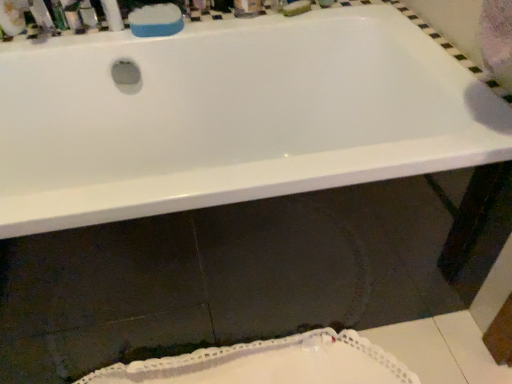
Find the location of a particular element. The width and height of the screenshot is (512, 384). white lace doily at lower center is located at coordinates (269, 363).

What is the approximate width of white lace doily at lower center?

The width of white lace doily at lower center is 20.89 centimeters.

Describe the element at coordinates (58, 15) in the screenshot. Image resolution: width=512 pixels, height=384 pixels. I see `metallic silver soap at upper left, the third toiletry viewed from the right` at that location.

Locate an element on the screen. metallic silver soap at upper left, the third toiletry viewed from the right is located at coordinates (58, 15).

This screenshot has height=384, width=512. What do you see at coordinates (232, 116) in the screenshot?
I see `white glossy bathtub at upper center` at bounding box center [232, 116].

What do you see at coordinates (73, 15) in the screenshot? This screenshot has width=512, height=384. I see `matte plastic toothbrush at upper left, the 2th toiletry in the left-to-right sequence` at bounding box center [73, 15].

Find the location of a particular element. The image size is (512, 384). white plastic mouthwash at upper left is located at coordinates [13, 16].

From the image's perspective, between matte plastic toothbrush at upper left, the 2th toiletry in the left-to-right sequence, and white plastic mouthwash at upper left, which one is located above?

matte plastic toothbrush at upper left, the 2th toiletry in the left-to-right sequence, from the image's perspective.

Considering the sizes of objects matte plastic toothbrush at upper left, the 2th toiletry in the left-to-right sequence, and white plastic mouthwash at upper left in the image provided, who is wider, matte plastic toothbrush at upper left, the 2th toiletry in the left-to-right sequence, or white plastic mouthwash at upper left?

With larger width is matte plastic toothbrush at upper left, the 2th toiletry in the left-to-right sequence.

How much distance is there between matte plastic toothbrush at upper left, the 2th toiletry in the left-to-right sequence, and white plastic mouthwash at upper left?

5.68 inches.

Is matte plastic toothbrush at upper left, acting as the second toiletry starting from the right, oriented away from white plastic mouthwash at upper left?

No, matte plastic toothbrush at upper left, acting as the second toiletry starting from the right, is not facing away from white plastic mouthwash at upper left.

Is point (168, 22) in front of point (52, 5)?

That is True.

From a real-world perspective, is blue sponge at upper center located beneath metallic silver soap at upper left, the third toiletry viewed from the right?

Yes, from a real-world perspective, blue sponge at upper center is under metallic silver soap at upper left, the third toiletry viewed from the right.

Is blue sponge at upper center not close to metallic silver soap at upper left, which is counted as the first toiletry, starting from the left?

No, blue sponge at upper center is not far away from metallic silver soap at upper left, which is counted as the first toiletry, starting from the left.

Considering the sizes of objects blue sponge at upper center and metallic silver soap at upper left, the third toiletry viewed from the right, in the image provided, who is smaller, blue sponge at upper center or metallic silver soap at upper left, the third toiletry viewed from the right,?

metallic silver soap at upper left, the third toiletry viewed from the right, is smaller.

From a real-world perspective, is white glossy bathtub at upper center above or below blue sponge at upper center?

In terms of real-world spatial position, white glossy bathtub at upper center is below blue sponge at upper center.

Is white glossy bathtub at upper center not inside blue sponge at upper center?

Yes, white glossy bathtub at upper center is not within blue sponge at upper center.

From the image's perspective, which is below, white glossy bathtub at upper center or blue sponge at upper center?

From the image's view, white glossy bathtub at upper center is below.

Considering the relative positions of white glossy bathtub at upper center and blue sponge at upper center in the image provided, is white glossy bathtub at upper center to the left of blue sponge at upper center from the viewer's perspective?

Incorrect, white glossy bathtub at upper center is not on the left side of blue sponge at upper center.

From the image's perspective, is metallic silver container at upper left, which is the 3th toiletry from left to right, positioned above or below metallic silver soap at upper left, the third toiletry viewed from the right?

Clearly, from the image's perspective, metallic silver container at upper left, which is the 3th toiletry from left to right, is below metallic silver soap at upper left, the third toiletry viewed from the right.

Considering the sizes of metallic silver container at upper left, which is the 3th toiletry from left to right, and metallic silver soap at upper left, which is counted as the first toiletry, starting from the left, in the image, is metallic silver container at upper left, which is the 3th toiletry from left to right, wider or thinner than metallic silver soap at upper left, which is counted as the first toiletry, starting from the left,?

Clearly, metallic silver container at upper left, which is the 3th toiletry from left to right, has more width compared to metallic silver soap at upper left, which is counted as the first toiletry, starting from the left.

Are metallic silver container at upper left, which is the 1th toiletry from right to left, and metallic silver soap at upper left, which is counted as the first toiletry, starting from the left, making contact?

Yes, metallic silver container at upper left, which is the 1th toiletry from right to left, and metallic silver soap at upper left, which is counted as the first toiletry, starting from the left, clearly make contact.

Is metallic silver container at upper left, which is the 1th toiletry from right to left, taller than metallic silver soap at upper left, which is counted as the first toiletry, starting from the left?

No.

Between metallic silver container at upper left, which is the 3th toiletry from left to right, and white plastic mouthwash at upper left, which one appears on the left side from the viewer's perspective?

Positioned to the left is white plastic mouthwash at upper left.

Would you say metallic silver container at upper left, which is the 1th toiletry from right to left, contains white plastic mouthwash at upper left?

No, white plastic mouthwash at upper left is not surrounded by metallic silver container at upper left, which is the 1th toiletry from right to left.

From a real-world perspective, which is physically above, metallic silver container at upper left, which is the 3th toiletry from left to right, or white plastic mouthwash at upper left?

In real-world perspective, white plastic mouthwash at upper left is above.

You are a GUI agent. You are given a task and a screenshot of the screen. Output one action in this format:
    pyautogui.click(x=<x>, y=<y>)
    Task: Click on the mouthwash on the left of the metallic silver soap at upper left, which is counted as the first toiletry, starting from the left
    
    Given the screenshot: What is the action you would take?
    pyautogui.click(x=13, y=16)

Which is more to the left, metallic silver soap at upper left, which is counted as the first toiletry, starting from the left, or white plastic mouthwash at upper left?

From the viewer's perspective, white plastic mouthwash at upper left appears more on the left side.

How different are the orientations of metallic silver soap at upper left, which is counted as the first toiletry, starting from the left, and white plastic mouthwash at upper left in degrees?

There is a 63.4-degree angle between the facing directions of metallic silver soap at upper left, which is counted as the first toiletry, starting from the left, and white plastic mouthwash at upper left.

Is metallic silver soap at upper left, the third toiletry viewed from the right, completely or partially outside of white plastic mouthwash at upper left?

Yes, metallic silver soap at upper left, the third toiletry viewed from the right, is located beyond the bounds of white plastic mouthwash at upper left.

Which is more to the left, metallic silver container at upper left, which is the 3th toiletry from left to right, or white glossy bathtub at upper center?

From the viewer's perspective, metallic silver container at upper left, which is the 3th toiletry from left to right, appears more on the left side.

Is metallic silver container at upper left, which is the 1th toiletry from right to left, facing away from white glossy bathtub at upper center?

No, metallic silver container at upper left, which is the 1th toiletry from right to left,'s orientation is not away from white glossy bathtub at upper center.

From the image's perspective, which one is positioned lower, metallic silver container at upper left, which is the 1th toiletry from right to left, or white glossy bathtub at upper center?

white glossy bathtub at upper center appears lower in the image.

What's the angular difference between metallic silver container at upper left, which is the 1th toiletry from right to left, and white glossy bathtub at upper center's facing directions?

metallic silver container at upper left, which is the 1th toiletry from right to left, and white glossy bathtub at upper center are facing 0.391 degrees away from each other.

This screenshot has width=512, height=384. I want to click on toiletry that is the 1st object located behind the white plastic mouthwash at upper left, so click(x=73, y=15).

Where is `soap that is in front of the metallic silver soap at upper left, which is counted as the first toiletry, starting from the left`? This screenshot has height=384, width=512. soap that is in front of the metallic silver soap at upper left, which is counted as the first toiletry, starting from the left is located at coordinates (156, 20).

When comparing their distances from matte plastic toothbrush at upper left, acting as the second toiletry starting from the right, does white glossy bathtub at upper center or white plastic mouthwash at upper left seem closer?

The object closer to matte plastic toothbrush at upper left, acting as the second toiletry starting from the right, is white plastic mouthwash at upper left.

In the scene shown: From the image, which object appears to be nearer to white plastic mouthwash at upper left, blue sponge at upper center or metallic silver soap at upper left, which is counted as the first toiletry, starting from the left?

The object closer to white plastic mouthwash at upper left is metallic silver soap at upper left, which is counted as the first toiletry, starting from the left.

From the image, which object appears to be farther from white glossy bathtub at upper center, white plastic mouthwash at upper left or metallic silver container at upper left, which is the 3th toiletry from left to right?

Based on the image, white plastic mouthwash at upper left appears to be further to white glossy bathtub at upper center.

When comparing their distances from blue sponge at upper center, does white lace doily at lower center or white glossy bathtub at upper center seem closer?

Based on the image, white glossy bathtub at upper center appears to be nearer to blue sponge at upper center.

Based on their spatial positions, is white glossy bathtub at upper center or blue sponge at upper center further from metallic silver soap at upper left, the third toiletry viewed from the right?

white glossy bathtub at upper center is further to metallic silver soap at upper left, the third toiletry viewed from the right.

Looking at the image, which one is located closer to blue sponge at upper center, metallic silver container at upper left, which is the 1th toiletry from right to left, or metallic silver soap at upper left, the third toiletry viewed from the right?

Based on the image, metallic silver container at upper left, which is the 1th toiletry from right to left, appears to be nearer to blue sponge at upper center.

From the picture: When comparing their distances from metallic silver container at upper left, which is the 3th toiletry from left to right, does white lace doily at lower center or blue sponge at upper center seem closer?

Based on the image, blue sponge at upper center appears to be nearer to metallic silver container at upper left, which is the 3th toiletry from left to right.

Considering their positions, is white glossy bathtub at upper center positioned further to blue sponge at upper center than metallic silver container at upper left, which is the 1th toiletry from right to left?

white glossy bathtub at upper center.

Find the location of a particular element. This screenshot has width=512, height=384. soap between matte plastic toothbrush at upper left, the 2th toiletry in the left-to-right sequence, and white lace doily at lower center, in the vertical direction is located at coordinates (156, 20).

Where is `bathtub between blue sponge at upper center and white lace doily at lower center in the up-down direction`? The width and height of the screenshot is (512, 384). bathtub between blue sponge at upper center and white lace doily at lower center in the up-down direction is located at coordinates (232, 116).

Where is `toiletry positioned between white glossy bathtub at upper center and metallic silver soap at upper left, which is counted as the first toiletry, starting from the left, from near to far`? This screenshot has width=512, height=384. toiletry positioned between white glossy bathtub at upper center and metallic silver soap at upper left, which is counted as the first toiletry, starting from the left, from near to far is located at coordinates (73, 15).

The image size is (512, 384). I want to click on soap between white glossy bathtub at upper center and metallic silver container at upper left, which is the 3th toiletry from left to right, in the front-back direction, so click(x=156, y=20).